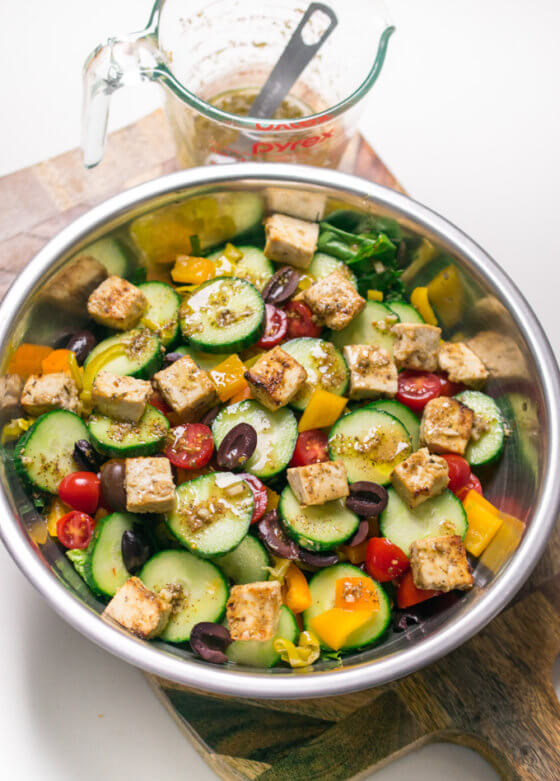
Find the location of a particular element. measuring cup handle is located at coordinates (290, 62).